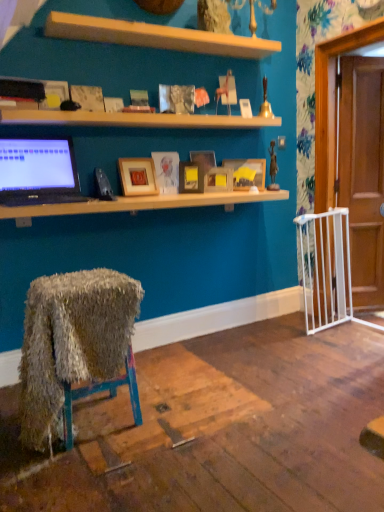
Locate an element on the screen. free space in front of matte gold picture frame at center, acting as the 4th picture frame starting from the right is located at coordinates click(x=187, y=199).